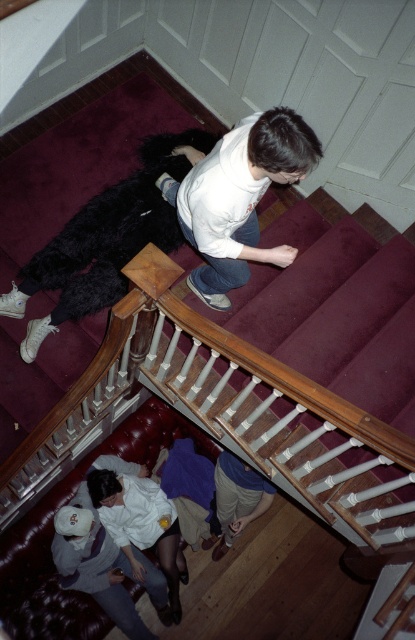
Is white matte shirt at upper center above white fabric shirt at lower left?

Correct, white matte shirt at upper center is located above white fabric shirt at lower left.

Between white matte shirt at upper center and white fabric shirt at lower left, which one is positioned higher?

Positioned higher is white matte shirt at upper center.

What are the coordinates of `white matte shirt at upper center` in the screenshot? It's located at (237, 196).

I want to click on white matte shirt at upper center, so tap(237, 196).

Between maroon carpet at upper center and white fabric shirt at lower left, which one is positioned lower?

Positioned lower is white fabric shirt at lower left.

Based on the photo, does maroon carpet at upper center have a larger size compared to white fabric shirt at lower left?

Correct, maroon carpet at upper center is larger in size than white fabric shirt at lower left.

The image size is (415, 640). What are the coordinates of `maroon carpet at upper center` in the screenshot? It's located at (199, 400).

Is white cotton shirt at lower center above white fabric shirt at lower left?

No.

Is the position of white cotton shirt at lower center more distant than that of white fabric shirt at lower left?

No, white cotton shirt at lower center is in front of white fabric shirt at lower left.

Identify the location of white cotton shirt at lower center. (95, 566).